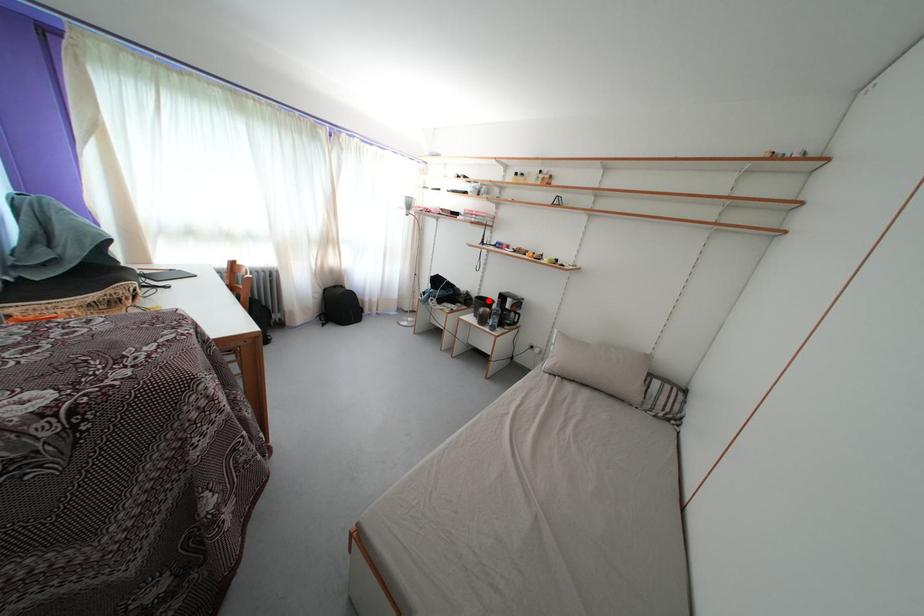
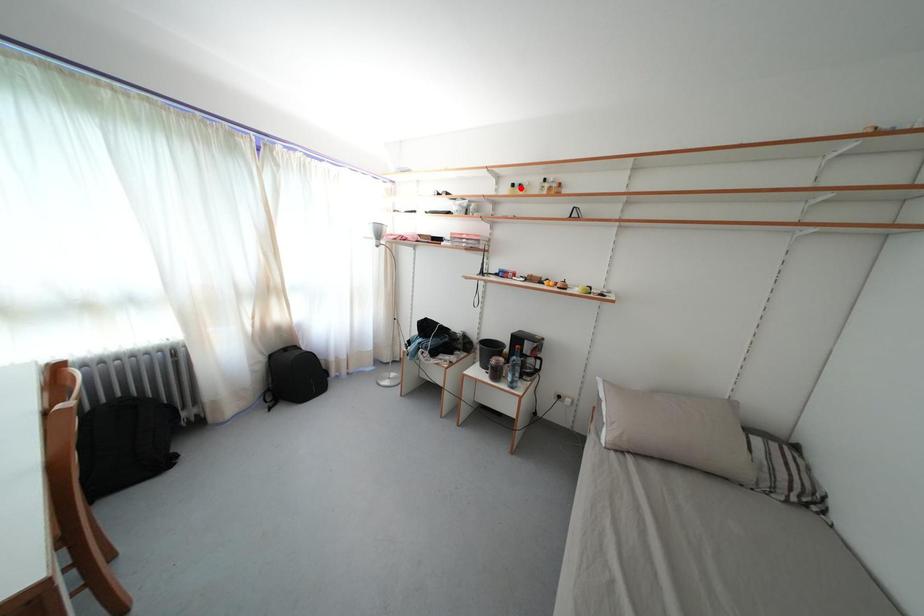
I am providing you with two images of the same scene from different viewpoints. A red point is marked on the first image and another point is marked on the second image. Are the points marked in image1 and image2 representing the same 3D position?

No